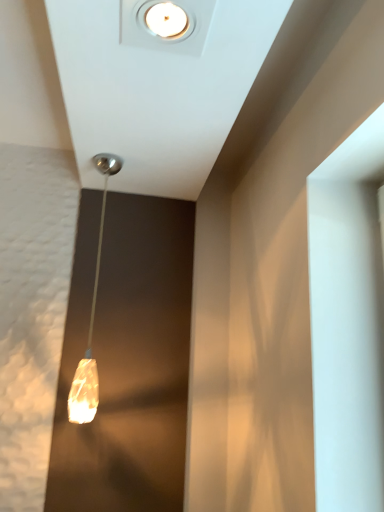
The width and height of the screenshot is (384, 512). Describe the element at coordinates (91, 321) in the screenshot. I see `translucent amber glass pendant at center` at that location.

What are the coordinates of `translucent amber glass pendant at center` in the screenshot? It's located at (91, 321).

Locate an element on the screen. translucent amber glass pendant at center is located at coordinates (91, 321).